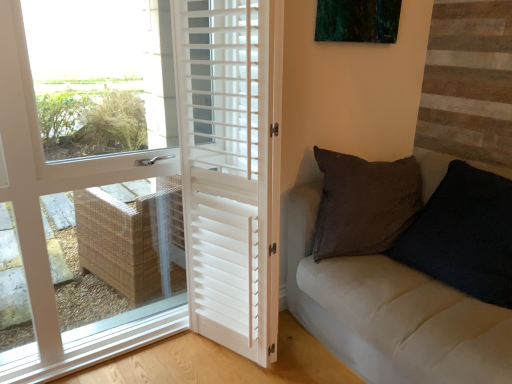
Question: From a real-world perspective, is white matte door at left, the second door in the right-to-left sequence, located beneath white matte shutters at center, which appears as the second door when viewed from the left?

Choices:
 (A) yes
 (B) no

Answer: (B)

Question: Is white matte door at left, the second door in the right-to-left sequence, wider than white matte shutters at center, which is the first door in right-to-left order?

Choices:
 (A) yes
 (B) no

Answer: (A)

Question: Is white matte door at left, the second door in the right-to-left sequence, further to camera compared to white matte shutters at center, which appears as the second door when viewed from the left?

Choices:
 (A) no
 (B) yes

Answer: (A)

Question: Is white matte door at left, the second door in the right-to-left sequence, bigger than white matte shutters at center, which is the first door in right-to-left order?

Choices:
 (A) yes
 (B) no

Answer: (A)

Question: Does white matte door at left, the second door in the right-to-left sequence, contain white matte shutters at center, which appears as the second door when viewed from the left?

Choices:
 (A) no
 (B) yes

Answer: (A)

Question: Is white matte shutters at center, which is the first door in right-to-left order, in front of or behind white matte door at left, which is counted as the first door, starting from the left, in the image?

Choices:
 (A) behind
 (B) front

Answer: (A)

Question: Is white matte shutters at center, which is the first door in right-to-left order, to the left or to the right of white matte door at left, the second door in the right-to-left sequence, in the image?

Choices:
 (A) right
 (B) left

Answer: (A)

Question: From the image's perspective, is white matte shutters at center, which appears as the second door when viewed from the left, located above or below white matte door at left, which is counted as the first door, starting from the left?

Choices:
 (A) below
 (B) above

Answer: (A)

Question: Considering the positions of white matte shutters at center, which appears as the second door when viewed from the left, and white matte door at left, which is counted as the first door, starting from the left, in the image, is white matte shutters at center, which appears as the second door when viewed from the left, bigger or smaller than white matte door at left, which is counted as the first door, starting from the left,?

Choices:
 (A) big
 (B) small

Answer: (B)

Question: Visually, is white matte shutters at center, which appears as the second door when viewed from the left, positioned to the left or to the right of velvet black pillow at right?

Choices:
 (A) right
 (B) left

Answer: (B)

Question: Does point (210, 79) appear closer or farther from the camera than point (459, 319)?

Choices:
 (A) farther
 (B) closer

Answer: (A)

Question: Choose the correct answer: Is white matte shutters at center, which is the first door in right-to-left order, inside velvet black pillow at right or outside it?

Choices:
 (A) inside
 (B) outside

Answer: (B)

Question: From the image's perspective, is white matte shutters at center, which appears as the second door when viewed from the left, located above or below velvet black pillow at right?

Choices:
 (A) below
 (B) above

Answer: (B)

Question: Considering the positions of velvet black pillow at right and white matte door at left, the second door in the right-to-left sequence, in the image, is velvet black pillow at right bigger or smaller than white matte door at left, the second door in the right-to-left sequence,?

Choices:
 (A) small
 (B) big

Answer: (A)

Question: Which is correct: velvet black pillow at right is inside white matte door at left, which is counted as the first door, starting from the left, or outside of it?

Choices:
 (A) outside
 (B) inside

Answer: (A)